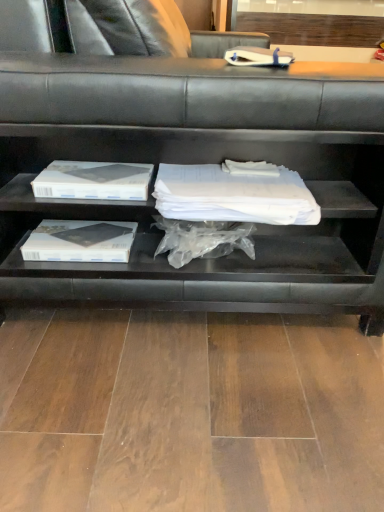
Question: Is black matte shelf at center wider or thinner than white paper at upper center?

Choices:
 (A) wide
 (B) thin

Answer: (A)

Question: Is black matte shelf at center inside the boundaries of white paper at upper center, or outside?

Choices:
 (A) outside
 (B) inside

Answer: (A)

Question: From a real-world perspective, is black matte shelf at center above or below white paper at upper center?

Choices:
 (A) above
 (B) below

Answer: (B)

Question: Visually, is white paper at upper center positioned to the left or to the right of black matte shelf at center?

Choices:
 (A) left
 (B) right

Answer: (B)

Question: Is point (230, 49) closer or farther from the camera than point (13, 176)?

Choices:
 (A) farther
 (B) closer

Answer: (A)

Question: Considering the positions of white paper at upper center and black matte shelf at center in the image, is white paper at upper center wider or thinner than black matte shelf at center?

Choices:
 (A) wide
 (B) thin

Answer: (B)

Question: From the image's perspective, is white paper at upper center positioned above or below black matte shelf at center?

Choices:
 (A) above
 (B) below

Answer: (B)